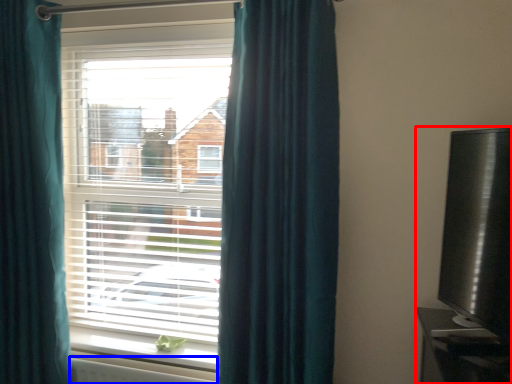
Question: Among these objects, which one is farthest to the camera, entertainment center (highlighted by a red box) or radiator (highlighted by a blue box)?

Choices:
 (A) entertainment center
 (B) radiator

Answer: (B)